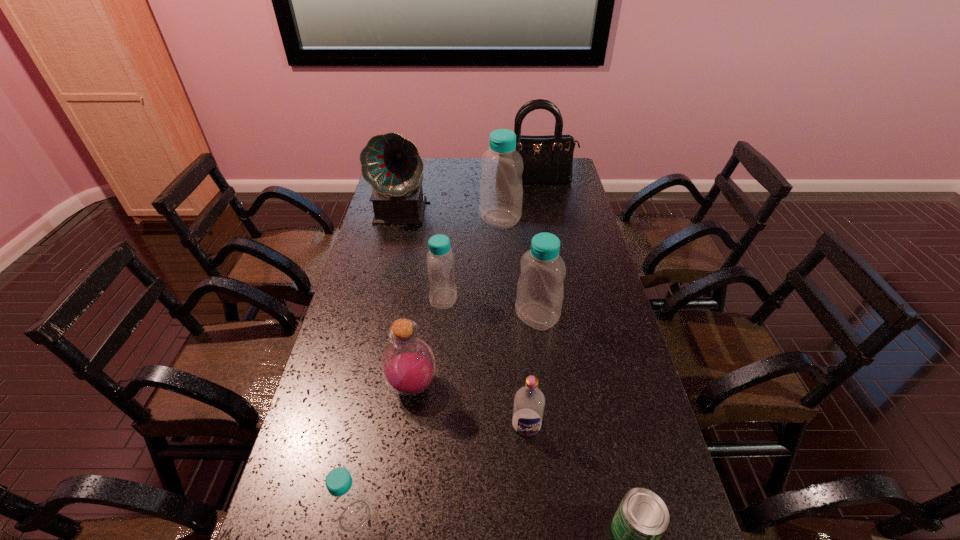
Locate an element on the screen. The width and height of the screenshot is (960, 540). free spot located on the right of the nearest blue bottle is located at coordinates (463, 516).

This screenshot has width=960, height=540. I want to click on object at the far edge, so click(548, 159).

Locate an element on the screen. record player present at the left edge is located at coordinates (391, 164).

Where is `bottle positioned at the left edge`? bottle positioned at the left edge is located at coordinates (349, 505).

This screenshot has height=540, width=960. I want to click on object located at the right edge, so click(548, 159).

Where is `object that is at the far right corner`? object that is at the far right corner is located at coordinates (548, 159).

At what (x,y) coordinates should I click in order to perform the action: click on free spot at the far edge of the desktop. Please return your answer as a coordinate pair (x, y). Looking at the image, I should click on (463, 163).

Where is `free spot at the left edge of the desktop`? This screenshot has width=960, height=540. free spot at the left edge of the desktop is located at coordinates (406, 246).

Locate an element on the screen. This screenshot has height=540, width=960. blank area at the right edge is located at coordinates (577, 288).

I want to click on vacant area between the record player and the third blue bottle from right to left, so click(423, 255).